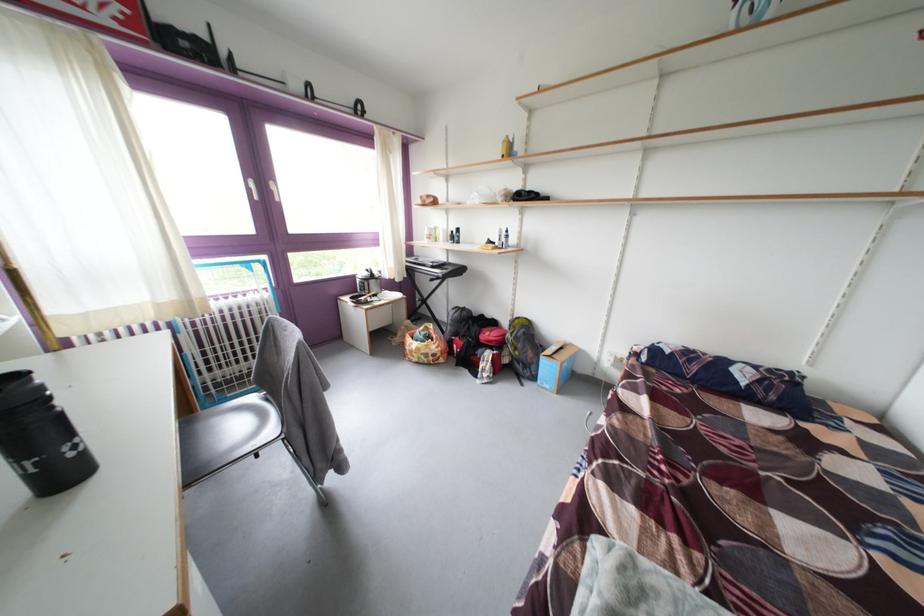
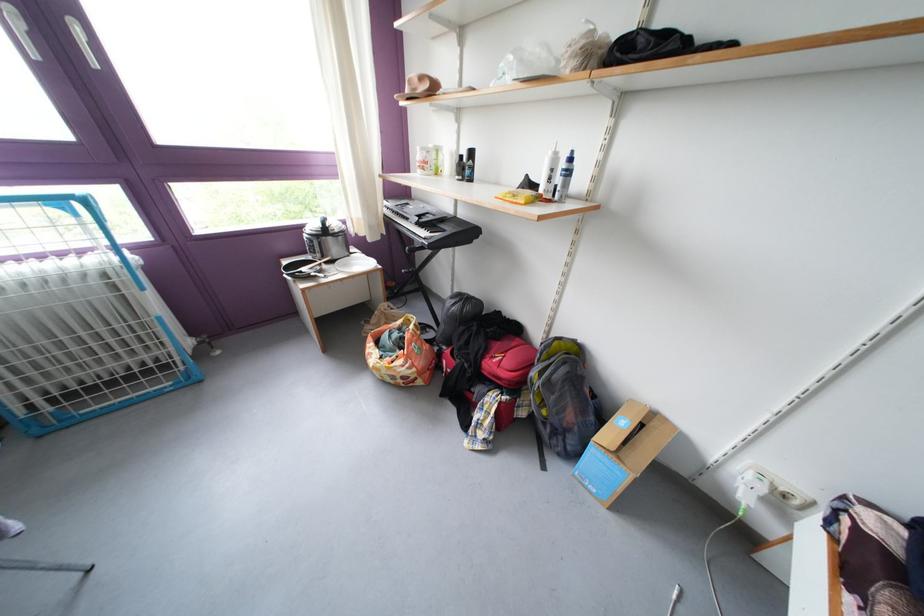
The point at (568,347) is marked in the first image. Where is the corresponding point in the second image?

(641, 407)